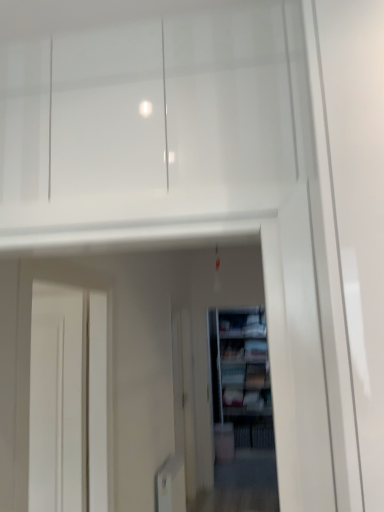
Question: Is matte white cabinet at center at the right side of wooden bookshelf at center?

Choices:
 (A) no
 (B) yes

Answer: (B)

Question: Can you confirm if matte white cabinet at center is thinner than wooden bookshelf at center?

Choices:
 (A) yes
 (B) no

Answer: (B)

Question: Is matte white cabinet at center oriented away from wooden bookshelf at center?

Choices:
 (A) no
 (B) yes

Answer: (A)

Question: From a real-world perspective, is matte white cabinet at center positioned under wooden bookshelf at center based on gravity?

Choices:
 (A) no
 (B) yes

Answer: (A)

Question: Are matte white cabinet at center and wooden bookshelf at center far apart?

Choices:
 (A) no
 (B) yes

Answer: (A)

Question: Is matte white cabinet at center positioned in front of wooden bookshelf at center?

Choices:
 (A) yes
 (B) no

Answer: (B)

Question: Is matte white cabinet at center smaller than white glossy screen door at center?

Choices:
 (A) no
 (B) yes

Answer: (B)

Question: Is matte white cabinet at center thinner than white glossy screen door at center?

Choices:
 (A) no
 (B) yes

Answer: (A)

Question: Is matte white cabinet at center outside white glossy screen door at center?

Choices:
 (A) yes
 (B) no

Answer: (A)

Question: Is matte white cabinet at center closer to camera compared to white glossy screen door at center?

Choices:
 (A) yes
 (B) no

Answer: (B)

Question: Considering the relative sizes of matte white cabinet at center and white glossy screen door at center in the image provided, is matte white cabinet at center shorter than white glossy screen door at center?

Choices:
 (A) yes
 (B) no

Answer: (A)

Question: Is matte white cabinet at center taller than white glossy screen door at center?

Choices:
 (A) yes
 (B) no

Answer: (B)

Question: Is matte white cabinet at center a part of wooden bookshelf at center?

Choices:
 (A) no
 (B) yes

Answer: (A)